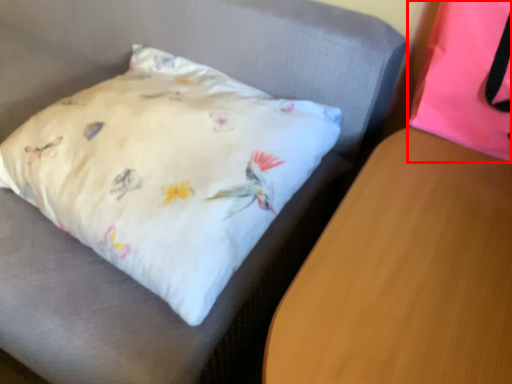
Question: Observing the image, what is the correct spatial positioning of pillow (annotated by the red box) in reference to table?

Choices:
 (A) right
 (B) left

Answer: (A)